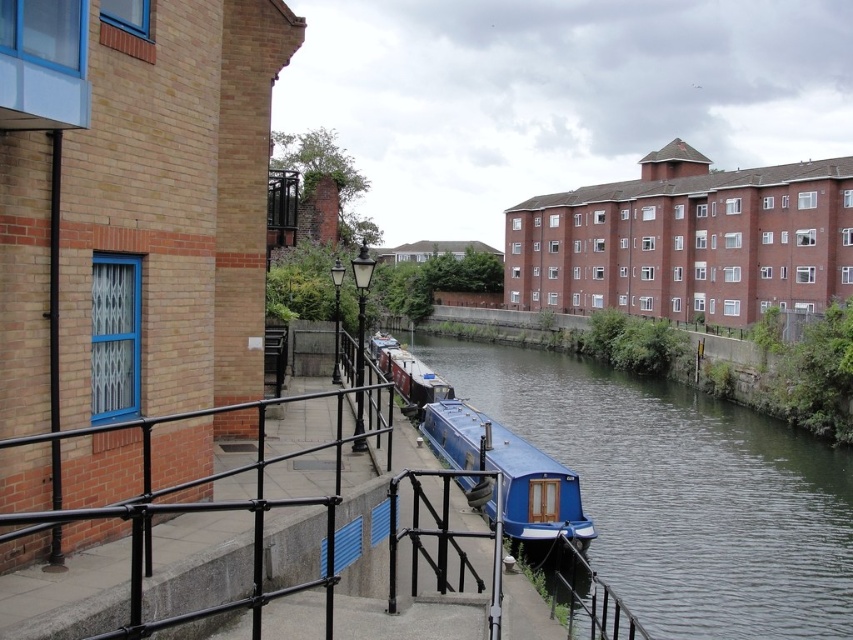
Question: Is blue glossy boat at center above matte blue boat at center?

Choices:
 (A) no
 (B) yes

Answer: (A)

Question: Which object appears farthest from the camera in this image?

Choices:
 (A) blue glossy boat at center
 (B) matte blue boat at center

Answer: (A)

Question: Which point is farther to the camera?

Choices:
 (A) blue glossy boat at center
 (B) matte blue boat at center

Answer: (A)

Question: Which of the following is the closest to the observer?

Choices:
 (A) (642, 531)
 (B) (515, 509)

Answer: (B)

Question: Does blue glossy boat at center come in front of matte blue boat at center?

Choices:
 (A) yes
 (B) no

Answer: (B)

Question: Can you confirm if blue glossy boat at center is smaller than matte blue boat at center?

Choices:
 (A) no
 (B) yes

Answer: (A)